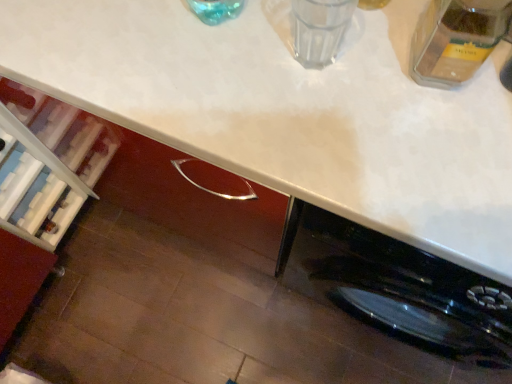
Question: Is transparent glass at upper center with white glossy countertop at upper center?

Choices:
 (A) no
 (B) yes

Answer: (A)

Question: Could you tell me if transparent glass at upper center is turned towards white glossy countertop at upper center?

Choices:
 (A) no
 (B) yes

Answer: (A)

Question: Is transparent glass at upper center wider than white glossy countertop at upper center?

Choices:
 (A) yes
 (B) no

Answer: (B)

Question: Is transparent glass at upper center at the left side of white glossy countertop at upper center?

Choices:
 (A) yes
 (B) no

Answer: (B)

Question: Is transparent glass at upper center not near white glossy countertop at upper center?

Choices:
 (A) no
 (B) yes

Answer: (A)

Question: Is transparent glass jar at upper right wider or thinner than transparent glass at upper center?

Choices:
 (A) thin
 (B) wide

Answer: (B)

Question: Is transparent glass jar at upper right inside or outside of transparent glass at upper center?

Choices:
 (A) inside
 (B) outside

Answer: (B)

Question: From a real-world perspective, relative to transparent glass at upper center, is transparent glass jar at upper right vertically above or below?

Choices:
 (A) above
 (B) below

Answer: (A)

Question: Is transparent glass jar at upper right taller or shorter than transparent glass at upper center?

Choices:
 (A) tall
 (B) short

Answer: (A)

Question: Is transparent glass at upper center bigger or smaller than white glossy countertop at upper center?

Choices:
 (A) big
 (B) small

Answer: (B)

Question: Would you say transparent glass at upper center is inside or outside white glossy countertop at upper center?

Choices:
 (A) outside
 (B) inside

Answer: (A)

Question: In terms of width, does transparent glass at upper center look wider or thinner when compared to white glossy countertop at upper center?

Choices:
 (A) thin
 (B) wide

Answer: (A)

Question: From the image's perspective, is transparent glass at upper center located above or below white glossy countertop at upper center?

Choices:
 (A) above
 (B) below

Answer: (A)

Question: Is point (267, 175) positioned closer to the camera than point (480, 49)?

Choices:
 (A) farther
 (B) closer

Answer: (A)

Question: Relative to transparent glass jar at upper right, is white glossy countertop at upper center in front or behind?

Choices:
 (A) behind
 (B) front

Answer: (B)